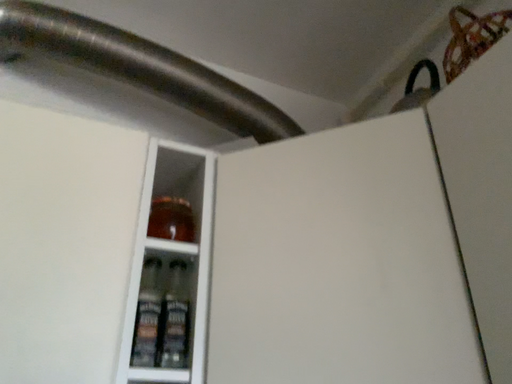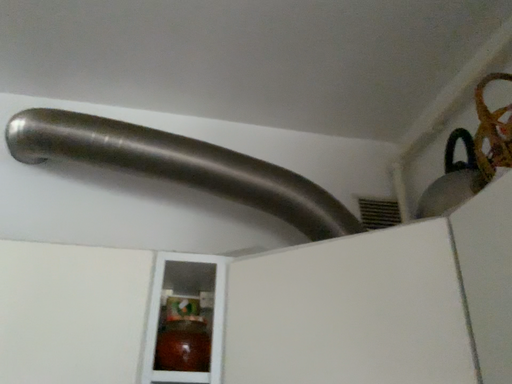
Question: How did the camera likely rotate when shooting the video?

Choices:
 (A) rotated left
 (B) rotated right

Answer: (A)